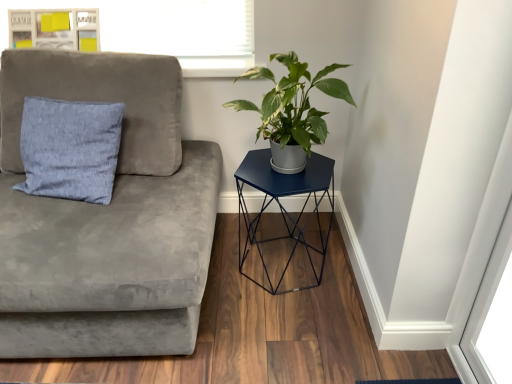
What do you see at coordinates (70, 148) in the screenshot? Image resolution: width=512 pixels, height=384 pixels. I see `light blue fabric pillow at left` at bounding box center [70, 148].

What are the coordinates of `suede gray couch at left` in the screenshot? It's located at (106, 218).

Describe the element at coordinates (283, 207) in the screenshot. This screenshot has height=384, width=512. I see `metallic blue hexagonal table at right` at that location.

The width and height of the screenshot is (512, 384). Identify the location of metallic blue hexagonal table at right. (283, 207).

The image size is (512, 384). What do you see at coordinates (55, 29) in the screenshot? I see `wooden frame at upper left` at bounding box center [55, 29].

Where is `light blue fabric pillow at left`? The height and width of the screenshot is (384, 512). light blue fabric pillow at left is located at coordinates (70, 148).

Which is more to the left, wooden frame at upper left or light blue fabric pillow at left?

Positioned to the left is wooden frame at upper left.

Between wooden frame at upper left and light blue fabric pillow at left, which one has smaller size?

Smaller between the two is wooden frame at upper left.

Does point (60, 24) come behind point (70, 158)?

Yes, point (60, 24) is behind point (70, 158).

Relative to light blue fabric pillow at left, is wooden frame at upper left in front or behind?

Clearly, wooden frame at upper left is behind light blue fabric pillow at left.

Between wooden frame at upper left and metallic blue hexagonal table at right, which one has smaller size?

wooden frame at upper left.

From the picture: Is wooden frame at upper left situated inside metallic blue hexagonal table at right or outside?

wooden frame at upper left is spatially situated outside metallic blue hexagonal table at right.

How far apart are wooden frame at upper left and metallic blue hexagonal table at right?

wooden frame at upper left and metallic blue hexagonal table at right are 1.09 meters apart.

Is wooden frame at upper left shorter than metallic blue hexagonal table at right?

Indeed, wooden frame at upper left has a lesser height compared to metallic blue hexagonal table at right.

Locate an element on the screen. The width and height of the screenshot is (512, 384). table directly beneath the green matte plant at upper right (from a real-world perspective) is located at coordinates (283, 207).

Is green matte plant at upper right to the right of metallic blue hexagonal table at right from the viewer's perspective?

No.

From the image's perspective, which object appears higher, green matte plant at upper right or metallic blue hexagonal table at right?

green matte plant at upper right, from the image's perspective.

Which is behind, point (297, 89) or point (315, 170)?

The point (315, 170) is more distant.

From a real-world perspective, who is located lower, light blue fabric pillow at left or wooden frame at upper left?

light blue fabric pillow at left.

Who is shorter, light blue fabric pillow at left or wooden frame at upper left?

Standing shorter between the two is wooden frame at upper left.

Is light blue fabric pillow at left directly adjacent to wooden frame at upper left?

light blue fabric pillow at left and wooden frame at upper left are not in contact.

How much distance is there between light blue fabric pillow at left and wooden frame at upper left?

light blue fabric pillow at left is 21.82 inches away from wooden frame at upper left.

Looking at this image, how different are the orientations of green matte plant at upper right and wooden frame at upper left in degrees?

1.04 degrees.

Is green matte plant at upper right facing towards wooden frame at upper left?

No, green matte plant at upper right is not oriented towards wooden frame at upper left.

From the image's perspective, is green matte plant at upper right positioned above or below wooden frame at upper left?

green matte plant at upper right is situated lower than wooden frame at upper left in the image.

Does green matte plant at upper right have a lesser width compared to wooden frame at upper left?

No, green matte plant at upper right is not thinner than wooden frame at upper left.

From the image's perspective, between green matte plant at upper right and suede gray couch at left, which one is located above?

green matte plant at upper right appears higher in the image.

Is green matte plant at upper right in front of suede gray couch at left?

No, it is behind suede gray couch at left.

Where is `houseplant behind the suede gray couch at left`? The width and height of the screenshot is (512, 384). houseplant behind the suede gray couch at left is located at coordinates (293, 103).

Measure the distance from green matte plant at upper right to suede gray couch at left.

The distance of green matte plant at upper right from suede gray couch at left is 22.19 inches.

Consider the image. Is light blue fabric pillow at left positioned behind green matte plant at upper right?

Yes, it is behind green matte plant at upper right.

Does light blue fabric pillow at left have a lesser height compared to green matte plant at upper right?

No, light blue fabric pillow at left is not shorter than green matte plant at upper right.

Is light blue fabric pillow at left oriented towards green matte plant at upper right?

No, light blue fabric pillow at left does not turn towards green matte plant at upper right.

What are the coordinates of `bulletin board that is above the light blue fabric pillow at left (from a real-world perspective)` in the screenshot? It's located at coord(55,29).

In order to click on table below the wooden frame at upper left (from the image's perspective) in this screenshot , I will do `click(283, 207)`.

Estimate the real-world distances between objects in this image. Which object is closer to wooden frame at upper left, light blue fabric pillow at left or green matte plant at upper right?

Among the two, light blue fabric pillow at left is located nearer to wooden frame at upper left.

In the scene shown: Based on their spatial positions, is light blue fabric pillow at left or suede gray couch at left closer to green matte plant at upper right?

suede gray couch at left lies closer to green matte plant at upper right than the other object.

Considering their positions, is metallic blue hexagonal table at right positioned closer to suede gray couch at left than light blue fabric pillow at left?

light blue fabric pillow at left.

Which object lies nearer to the anchor point metallic blue hexagonal table at right, light blue fabric pillow at left or suede gray couch at left?

suede gray couch at left is positioned closer to the anchor metallic blue hexagonal table at right.

When comparing their distances from green matte plant at upper right, does wooden frame at upper left or suede gray couch at left seem further?

wooden frame at upper left is positioned further to the anchor green matte plant at upper right.

From the image, which object appears to be nearer to suede gray couch at left, wooden frame at upper left or light blue fabric pillow at left?

Among the two, light blue fabric pillow at left is located nearer to suede gray couch at left.

From the image, which object appears to be nearer to metallic blue hexagonal table at right, green matte plant at upper right or light blue fabric pillow at left?

green matte plant at upper right.

Looking at the image, which one is located further to light blue fabric pillow at left, metallic blue hexagonal table at right or wooden frame at upper left?

metallic blue hexagonal table at right is further to light blue fabric pillow at left.

Locate an element on the screen. studio couch situated between wooden frame at upper left and green matte plant at upper right from left to right is located at coordinates (106, 218).

This screenshot has width=512, height=384. Identify the location of houseplant between suede gray couch at left and metallic blue hexagonal table at right. (293, 103).

Identify the location of pillow situated between suede gray couch at left and green matte plant at upper right from left to right. Image resolution: width=512 pixels, height=384 pixels. (70, 148).

The image size is (512, 384). Identify the location of pillow between suede gray couch at left and wooden frame at upper left from front to back. point(70,148).